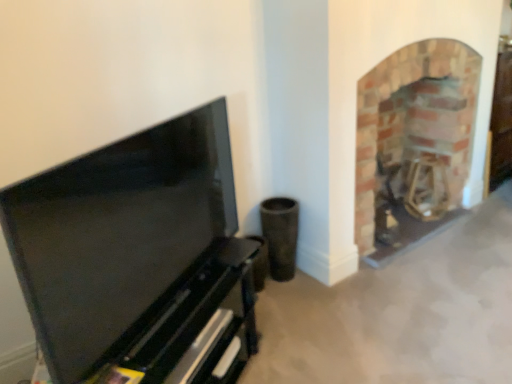
This screenshot has width=512, height=384. Identify the location of vacant space in front of brick fireplace at right. (422, 287).